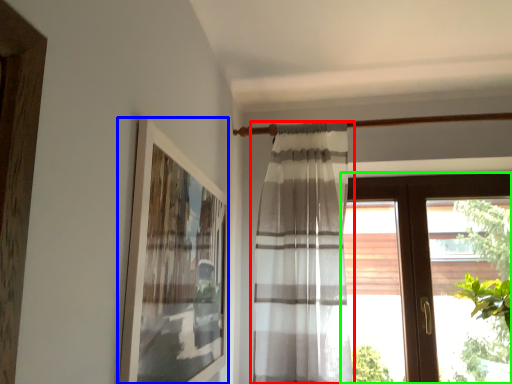
Question: Estimate the real-world distances between objects in this image. Which object is farther from curtain (highlighted by a red box), picture frame (highlighted by a blue box) or window (highlighted by a green box)?

Choices:
 (A) picture frame
 (B) window

Answer: (B)